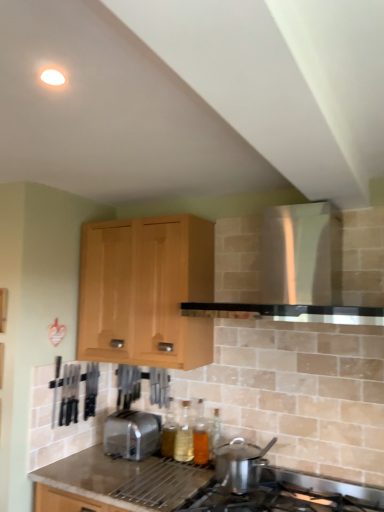
Question: Is translucent glass bottle at center, the third bottle when ordered from left to right, further to camera compared to satin silver toaster at lower center?

Choices:
 (A) yes
 (B) no

Answer: (A)

Question: Is translucent glass bottle at center, the first bottle in the right-to-left sequence, smaller than satin silver toaster at lower center?

Choices:
 (A) yes
 (B) no

Answer: (A)

Question: Would you say translucent glass bottle at center, the third bottle when ordered from left to right, contains satin silver toaster at lower center?

Choices:
 (A) yes
 (B) no

Answer: (B)

Question: Is translucent glass bottle at center, the first bottle in the right-to-left sequence, to the right of satin silver toaster at lower center from the viewer's perspective?

Choices:
 (A) no
 (B) yes

Answer: (B)

Question: Could you tell me if translucent glass bottle at center, the first bottle in the right-to-left sequence, is turned towards satin silver toaster at lower center?

Choices:
 (A) no
 (B) yes

Answer: (A)

Question: Is point (288, 318) closer or farther from the camera than point (152, 509)?

Choices:
 (A) farther
 (B) closer

Answer: (B)

Question: In terms of height, does white glossy vent at upper center look taller or shorter compared to granite gray countertop at lower center?

Choices:
 (A) short
 (B) tall

Answer: (B)

Question: From the image's perspective, is white glossy vent at upper center located above or below granite gray countertop at lower center?

Choices:
 (A) above
 (B) below

Answer: (A)

Question: Would you say white glossy vent at upper center is inside or outside granite gray countertop at lower center?

Choices:
 (A) inside
 (B) outside

Answer: (B)

Question: Considering their positions, is stainless steel pot at lower center located in front of or behind translucent glass bottle at lower center, marked as the second bottle in a left-to-right arrangement?

Choices:
 (A) behind
 (B) front

Answer: (B)

Question: From the image's perspective, is stainless steel pot at lower center above or below translucent glass bottle at lower center, positioned as the second bottle in right-to-left order?

Choices:
 (A) below
 (B) above

Answer: (A)

Question: Considering the positions of point (228, 500) and point (185, 404), is point (228, 500) closer or farther from the camera than point (185, 404)?

Choices:
 (A) farther
 (B) closer

Answer: (B)

Question: Based on their positions, is stainless steel pot at lower center located to the left or right of translucent glass bottle at lower center, marked as the second bottle in a left-to-right arrangement?

Choices:
 (A) left
 (B) right

Answer: (B)

Question: Would you say satin silver toaster at lower center is inside or outside translucent glass bottle at lower center, positioned as the second bottle in right-to-left order?

Choices:
 (A) inside
 (B) outside

Answer: (B)

Question: From their relative heights in the image, would you say satin silver toaster at lower center is taller or shorter than translucent glass bottle at lower center, marked as the second bottle in a left-to-right arrangement?

Choices:
 (A) tall
 (B) short

Answer: (B)